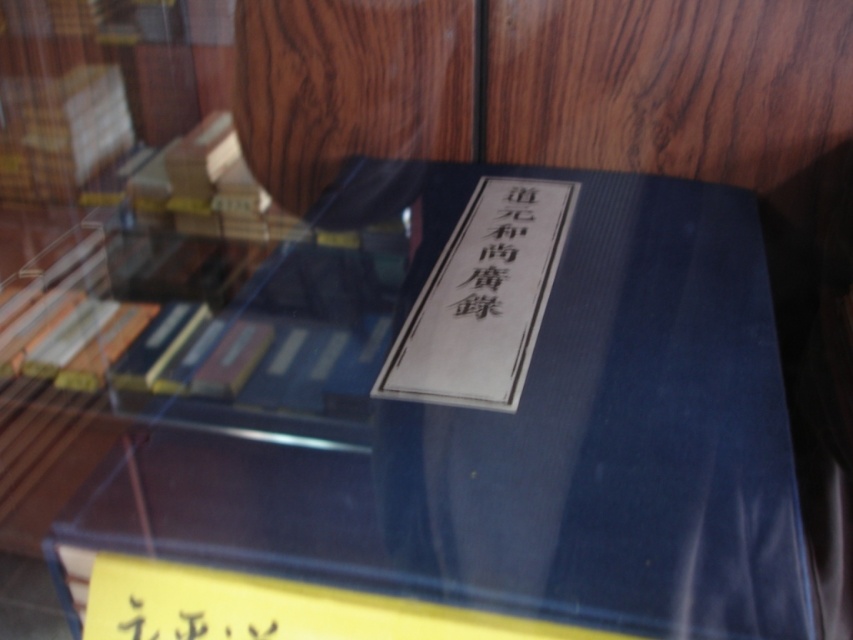
Question: Which object appears closest to the camera in this image?

Choices:
 (A) white paper book at center
 (B) black paper at center

Answer: (A)

Question: Can you confirm if white paper book at center is wider than black paper at lower center?

Choices:
 (A) yes
 (B) no

Answer: (A)

Question: Estimate the real-world distances between objects in this image. Which object is farther from the black paper at lower center?

Choices:
 (A) black paper at center
 (B) white paper book at center

Answer: (A)

Question: Which point appears closest to the camera in this image?

Choices:
 (A) (409, 330)
 (B) (445, 280)

Answer: (A)

Question: Is white paper book at center closer to camera compared to black paper at lower center?

Choices:
 (A) yes
 (B) no

Answer: (B)

Question: Considering the relative positions of white paper book at center and black paper at center in the image provided, where is white paper book at center located with respect to black paper at center?

Choices:
 (A) left
 (B) right

Answer: (A)